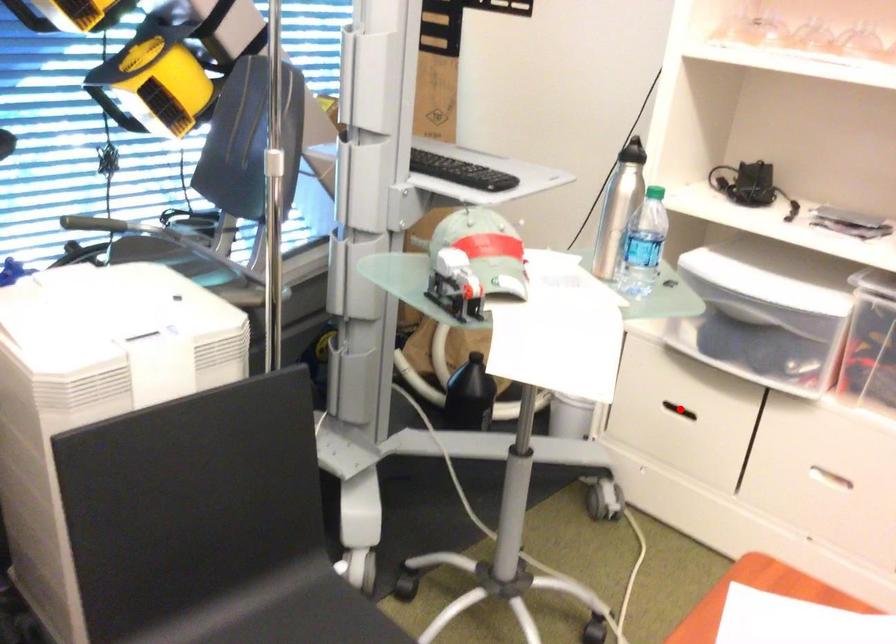
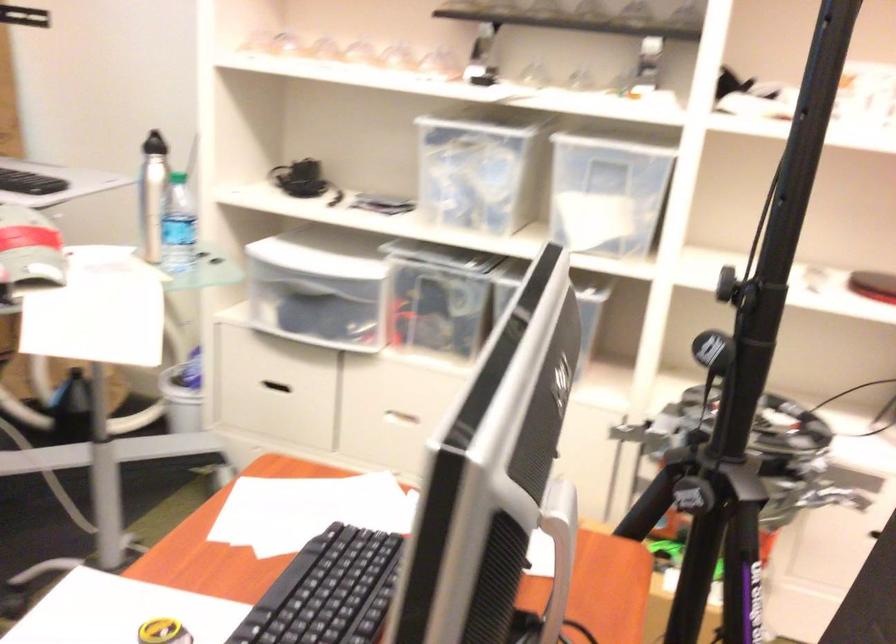
The point at the highlighted location is marked in the first image. Where is the corresponding point in the second image?

(271, 389)